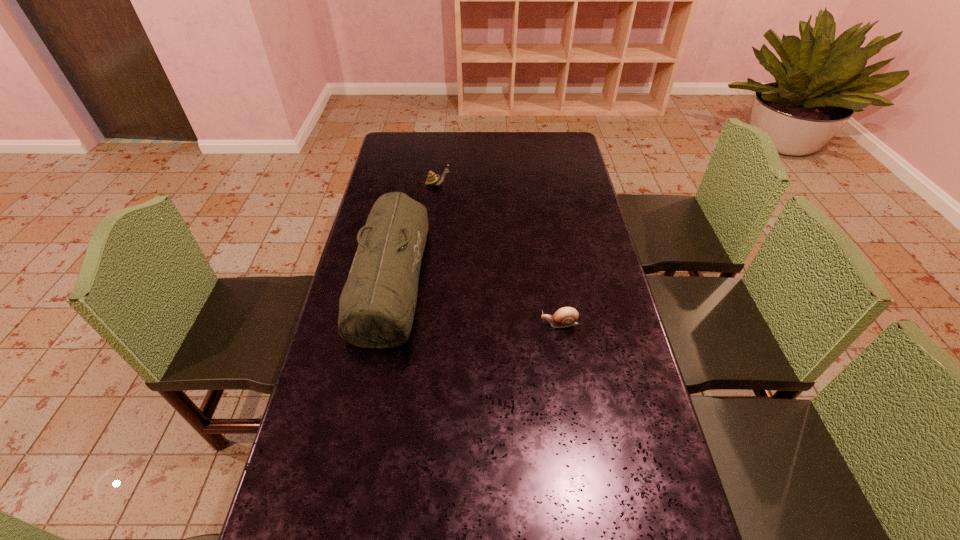
The width and height of the screenshot is (960, 540). I want to click on the tallest object, so click(x=377, y=305).

This screenshot has width=960, height=540. I want to click on the left escargot, so click(432, 179).

Image resolution: width=960 pixels, height=540 pixels. What are the coordinates of `the farther escargot` in the screenshot? It's located at (432, 179).

Locate an element on the screen. This screenshot has width=960, height=540. the right escargot is located at coordinates (567, 316).

Image resolution: width=960 pixels, height=540 pixels. What are the coordinates of `the rightmost object` in the screenshot? It's located at (567, 316).

At what (x,y) coordinates should I click in order to perform the action: click on vacant region located 0.360m on the back of the tallest object. Please return your answer as a coordinate pair (x, y). This screenshot has height=540, width=960. Looking at the image, I should click on (413, 166).

Locate an element on the screen. The width and height of the screenshot is (960, 540). vacant space located 0.100m on the face of the left escargot is located at coordinates (476, 184).

Where is `vacant space located on the front-facing side of the right escargot`? vacant space located on the front-facing side of the right escargot is located at coordinates (492, 323).

Identify the location of vacant space located 0.160m on the front-facing side of the right escargot. (484, 323).

In order to click on vacant space located 0.070m on the front-facing side of the right escargot in this screenshot , I will do `click(516, 323)`.